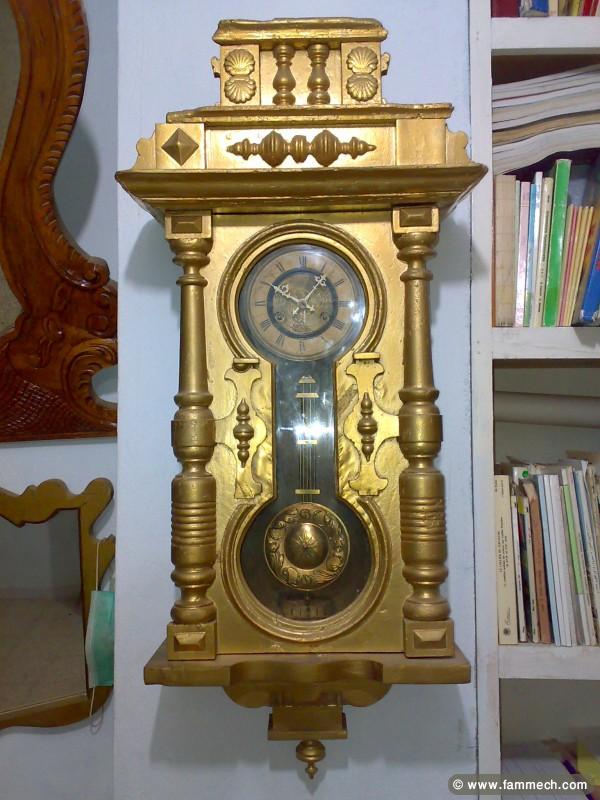
This screenshot has width=600, height=800. Identify the location of bookshelf. (537, 653), (538, 338), (478, 350), (523, 442), (541, 704), (521, 65), (548, 41), (478, 18), (493, 746), (496, 668).